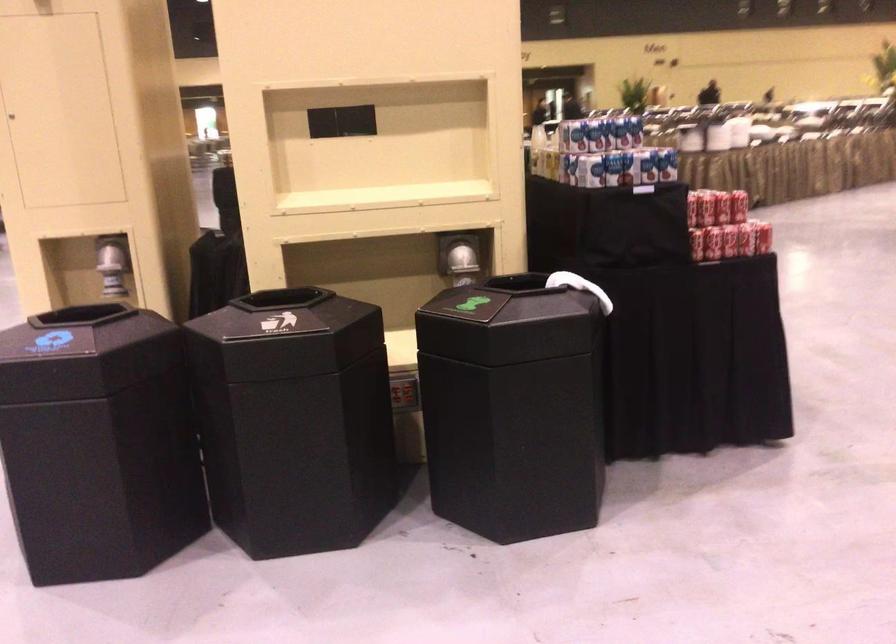
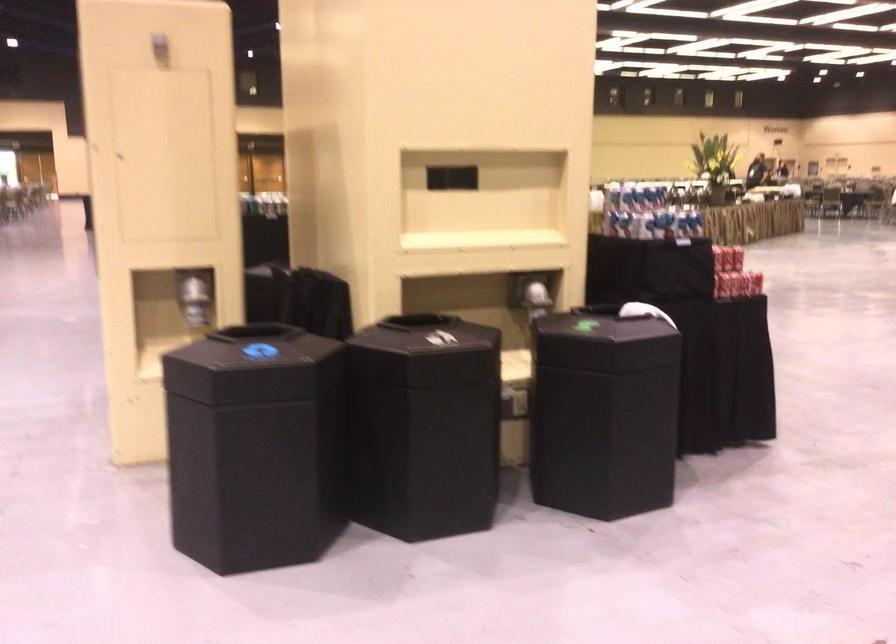
Find the pixel in the second image that matches (455,267) in the first image.

(536, 299)